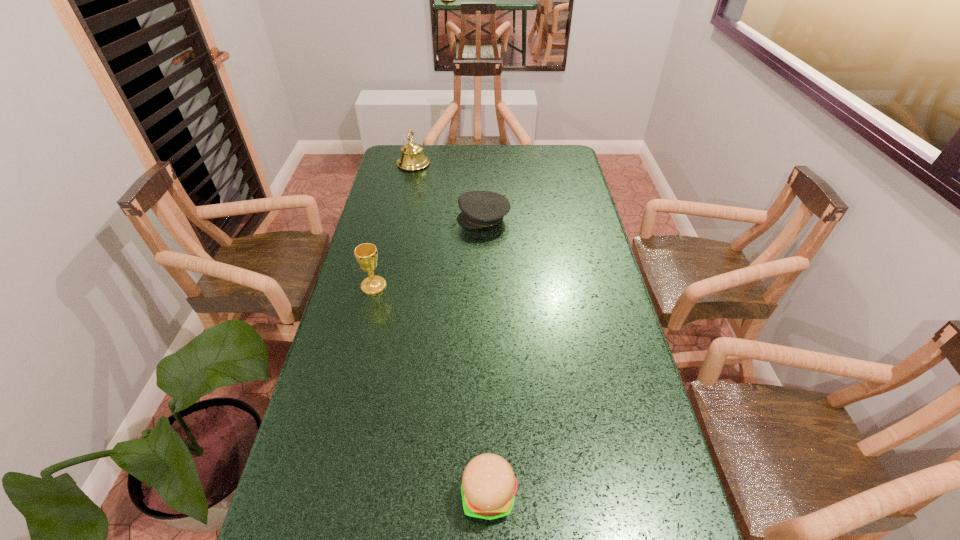
The image size is (960, 540). I want to click on the farthest object, so click(412, 157).

You are a GUI agent. You are given a task and a screenshot of the screen. Output one action in this format:
    pyautogui.click(x=<x>, y=<y>)
    Task: Click on the chalice
    The height and width of the screenshot is (540, 960).
    Given the screenshot: What is the action you would take?
    pyautogui.click(x=366, y=254)

The image size is (960, 540). In order to click on the nearest object in this screenshot , I will do pyautogui.click(x=488, y=489).

Where is `beret`? This screenshot has height=540, width=960. beret is located at coordinates (480, 209).

The width and height of the screenshot is (960, 540). Identify the location of vacant space located on the right of the farthest object. click(x=484, y=164).

In order to click on vacant region located 0.110m on the front of the second nearest object in this screenshot , I will do `click(365, 322)`.

Identify the location of free space located 0.270m on the back of the nearest object. (487, 368).

The height and width of the screenshot is (540, 960). What are the coordinates of `blank space located 0.120m on the front-facing side of the third nearest object` in the screenshot? It's located at (425, 219).

At what (x,y) coordinates should I click in order to perform the action: click on vacant space located on the front-facing side of the third nearest object. Please return your answer as a coordinate pair (x, y). Looking at the image, I should click on (391, 219).

Where is `vacant position located 0.130m on the front-facing side of the third nearest object`? This screenshot has height=540, width=960. vacant position located 0.130m on the front-facing side of the third nearest object is located at coordinates (422, 219).